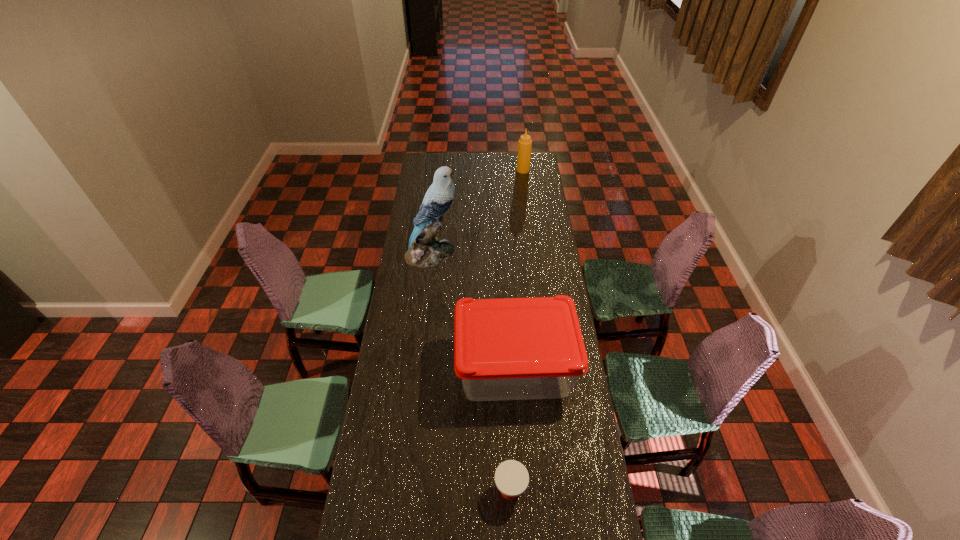
Identify the location of free space between the farthest object and the third farthest object. (518, 269).

Image resolution: width=960 pixels, height=540 pixels. Identify the location of free space between the tray and the farthest object. (518, 269).

Identify the location of object that is the third nearest to the third nearest object. The image size is (960, 540). (511, 477).

This screenshot has width=960, height=540. I want to click on object that is the closest to the farthest object, so click(424, 249).

Where is `blank area in the image that satisfies the following two spatial constraints: 1. on the back side of the nearest object; 2. on the face of the leftmost object`? This screenshot has height=540, width=960. blank area in the image that satisfies the following two spatial constraints: 1. on the back side of the nearest object; 2. on the face of the leftmost object is located at coordinates (499, 253).

In order to click on vacant space that satisfies the following two spatial constraints: 1. on the back side of the third farthest object; 2. on the left side of the nearest object in this screenshot , I will do coord(505,368).

Find the location of a particular element. free point that satisfies the following two spatial constraints: 1. on the face of the leftmost object; 2. on the left side of the Dixie cup is located at coordinates (405, 490).

Image resolution: width=960 pixels, height=540 pixels. What are the coordinates of `vacant region that satisfies the following two spatial constraints: 1. on the face of the second nearest object; 2. on the left side of the tallest object` in the screenshot? It's located at (419, 368).

This screenshot has width=960, height=540. Identify the location of free space that satisfies the following two spatial constraints: 1. on the back side of the condiment; 2. on the right side of the nearest object. (495, 170).